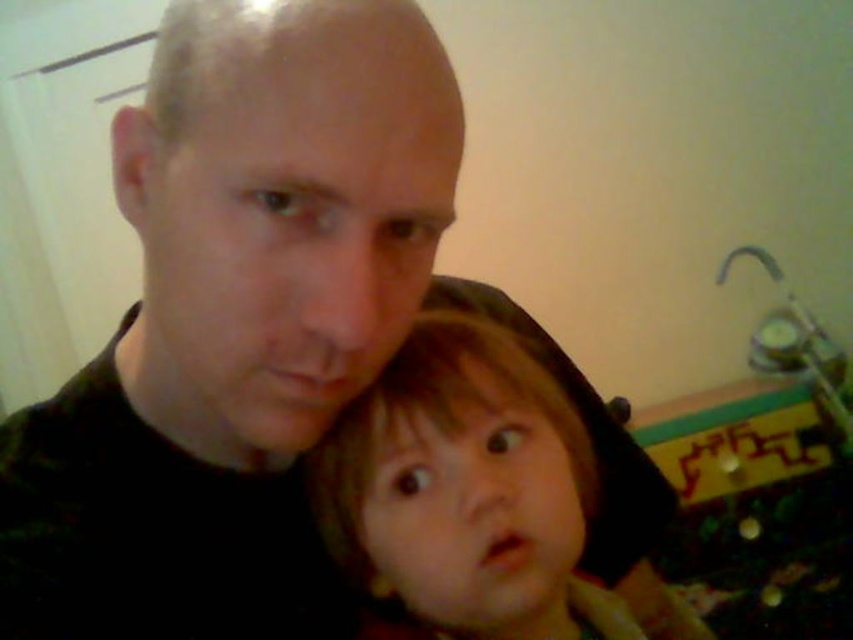
You are a photographer trying to focus on the black matte shirt at center and the smooth brown hair at center in the image. Which object should you adjust your camera to focus on first if you want to capture both in sharp detail?

The black matte shirt at center is located above smooth brown hair at center, so you should focus on the smooth brown hair at center first because it is closer to the camera.